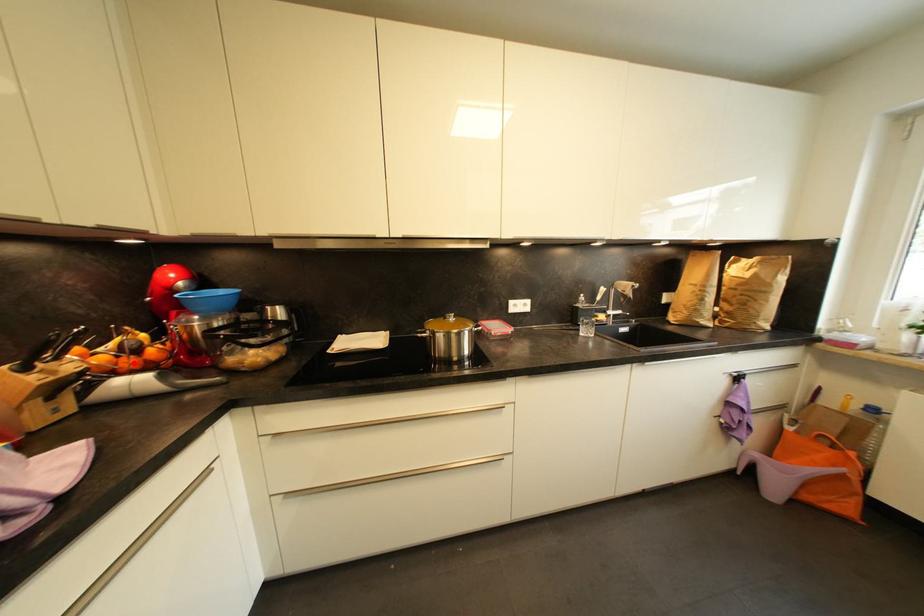
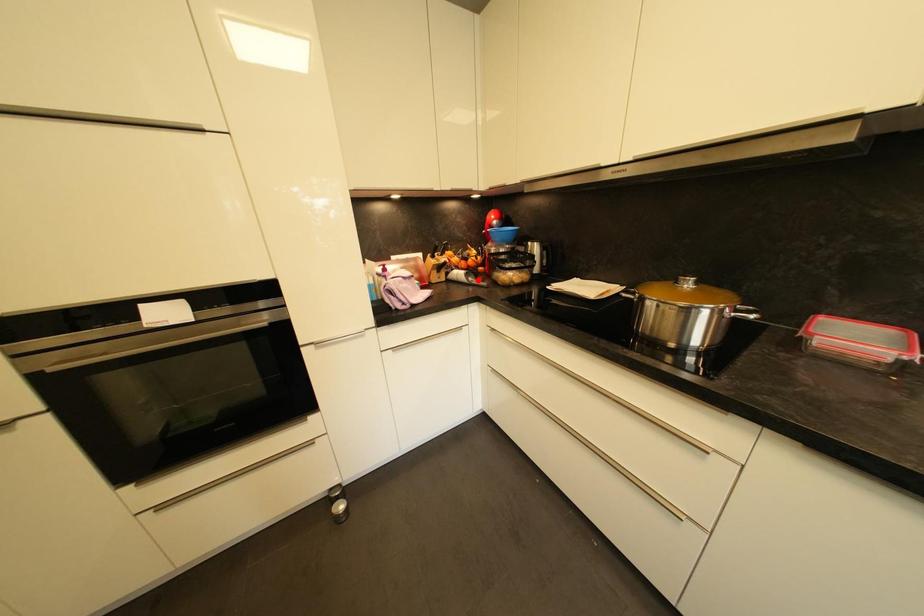
I am providing you with two images of the same scene from different viewpoints. A red point is marked on the first image and another point is marked on the second image. Do the highlighted points in image1 and image2 indicate the same real-world spot?

No